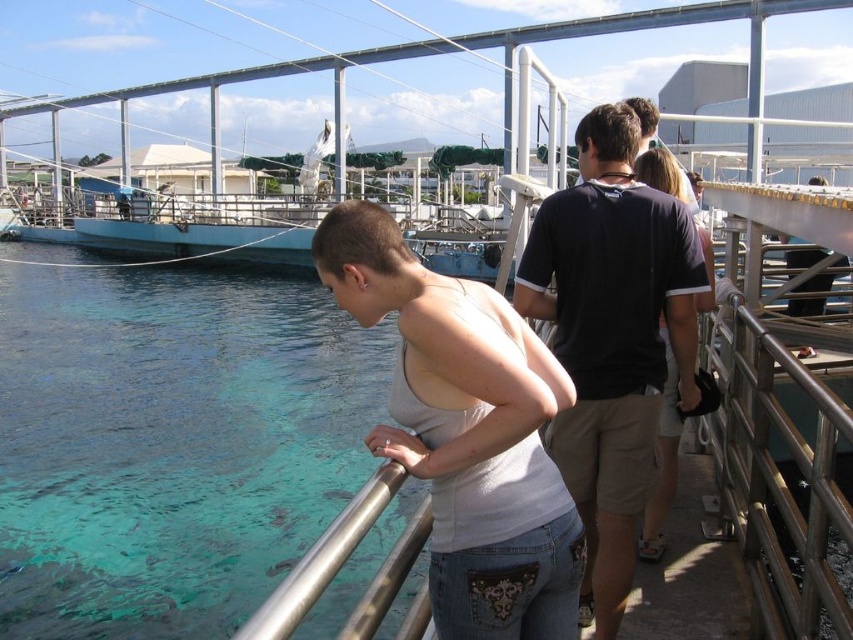
Question: Where is white matte tank top at center located in relation to black cotton shirt at center in the image?

Choices:
 (A) above
 (B) below

Answer: (A)

Question: Which point is closer to the camera?

Choices:
 (A) (810, 540)
 (B) (10, 355)

Answer: (A)

Question: Which object appears closest to the camera in this image?

Choices:
 (A) black cotton shirt at center
 (B) metallic silver railing at right
 (C) clear blue water at lower left

Answer: (C)

Question: Observing the image, what is the correct spatial positioning of white matte tank top at center in reference to metallic silver railing at right?

Choices:
 (A) below
 (B) above

Answer: (B)

Question: Is clear blue water at lower left to the right of metallic silver railing at right from the viewer's perspective?

Choices:
 (A) no
 (B) yes

Answer: (A)

Question: Which of these objects is positioned closest to the black cotton shirt at center?

Choices:
 (A) white matte tank top at center
 (B) clear blue water at lower left
 (C) metallic silver railing at right

Answer: (A)